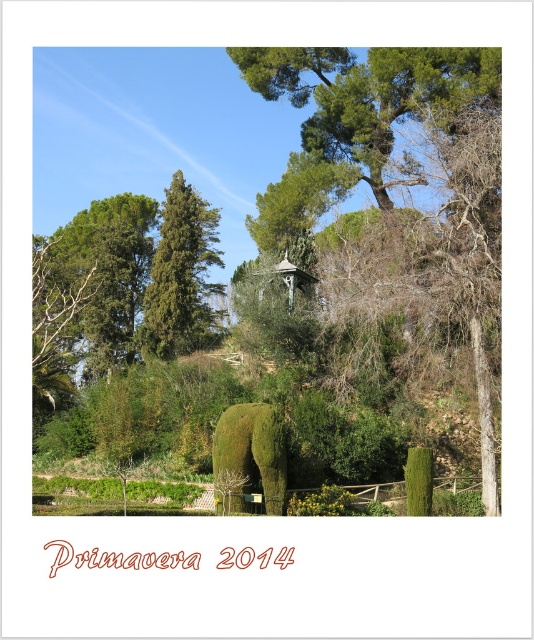
You are a landscape architect designing a new garden layout. You need to place a new statue in the garden such that it is between the green leafy tree at center and the green leafy tree at upper left. Considering their sizes, where should the statue be positioned to maintain visual balance?

The green leafy tree at center is larger in size than the green leafy tree at upper left. To maintain visual balance, the statue should be placed closer to the larger tree at the center to counterbalance its size with the smaller tree at upper left.

You are a photographer planning to take a picture of the green leafy tree at upper left and the green mossy elephant at center. Based on their sizes in the scene, which one would appear larger in the photo?

The green leafy tree at upper left is much taller than the green mossy elephant at center, so it would appear larger in the photo.